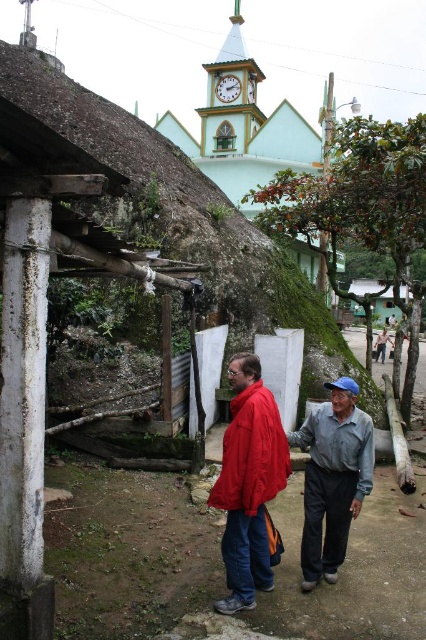
Question: Among these points, which one is farthest from the camera?

Choices:
 (A) (255, 202)
 (B) (233, 76)

Answer: (B)

Question: Does green leafy tree at center appear on the right side of white painted wood clock tower at upper center?

Choices:
 (A) no
 (B) yes

Answer: (B)

Question: Can you confirm if white painted wood clock tower at upper center is positioned to the right of white wooden clock at upper center?

Choices:
 (A) yes
 (B) no

Answer: (A)

Question: Considering the relative positions of matte red jacket at center and white wooden clock at upper center in the image provided, where is matte red jacket at center located with respect to white wooden clock at upper center?

Choices:
 (A) right
 (B) left

Answer: (B)

Question: Estimate the real-world distances between objects in this image. Which object is closer to the white painted wood clock tower at upper center?

Choices:
 (A) matte red jacket at center
 (B) green leafy tree at center
 (C) gray cotton shirt at lower right
 (D) white wooden clock at upper center

Answer: (D)

Question: Which point is farther from the camera taking this photo?

Choices:
 (A) (235, 88)
 (B) (322, 420)

Answer: (A)